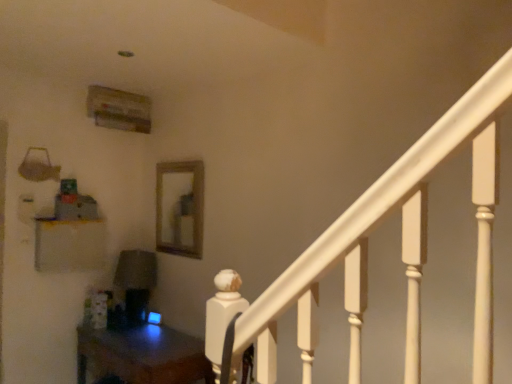
Question: From the image's perspective, is wooden frame mirror at center over wooden table at lower left?

Choices:
 (A) yes
 (B) no

Answer: (A)

Question: Is the position of wooden frame mirror at center less distant than that of wooden table at lower left?

Choices:
 (A) no
 (B) yes

Answer: (A)

Question: Is wooden frame mirror at center not inside wooden table at lower left?

Choices:
 (A) no
 (B) yes

Answer: (B)

Question: From the image's perspective, does wooden frame mirror at center appear lower than wooden table at lower left?

Choices:
 (A) yes
 (B) no

Answer: (B)

Question: Is wooden frame mirror at center to the right of wooden table at lower left from the viewer's perspective?

Choices:
 (A) yes
 (B) no

Answer: (A)

Question: Considering their positions, is wooden table at lower left located in front of or behind matte white shelf at left?

Choices:
 (A) behind
 (B) front

Answer: (B)

Question: Considering the positions of wooden table at lower left and matte white shelf at left in the image, is wooden table at lower left wider or thinner than matte white shelf at left?

Choices:
 (A) wide
 (B) thin

Answer: (A)

Question: Is point (210, 372) closer or farther from the camera than point (52, 261)?

Choices:
 (A) farther
 (B) closer

Answer: (B)

Question: From the image's perspective, is wooden table at lower left above or below matte white shelf at left?

Choices:
 (A) below
 (B) above

Answer: (A)

Question: From the image's perspective, is wooden frame mirror at center located above or below matte white shelf at left?

Choices:
 (A) above
 (B) below

Answer: (A)

Question: Considering the positions of point (175, 238) and point (90, 258), is point (175, 238) closer or farther from the camera than point (90, 258)?

Choices:
 (A) farther
 (B) closer

Answer: (A)

Question: Looking at their shapes, would you say wooden frame mirror at center is wider or thinner than matte white shelf at left?

Choices:
 (A) thin
 (B) wide

Answer: (A)

Question: In the image, is wooden frame mirror at center positioned in front of or behind matte white shelf at left?

Choices:
 (A) behind
 (B) front

Answer: (A)

Question: Is point (55, 256) positioned closer to the camera than point (181, 382)?

Choices:
 (A) farther
 (B) closer

Answer: (A)

Question: Considering the positions of matte white shelf at left and wooden table at lower left in the image, is matte white shelf at left bigger or smaller than wooden table at lower left?

Choices:
 (A) small
 (B) big

Answer: (A)